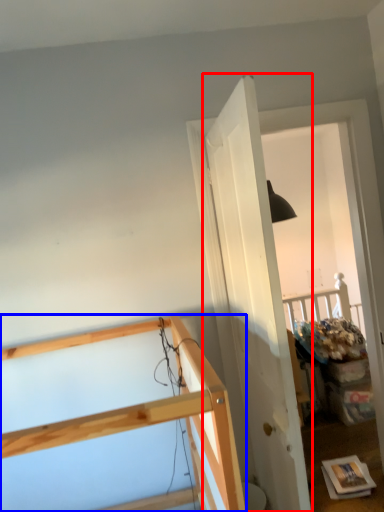
Question: Which point is closer to the camera, door (highlighted by a red box) or furniture (highlighted by a blue box)?

Choices:
 (A) door
 (B) furniture

Answer: (B)